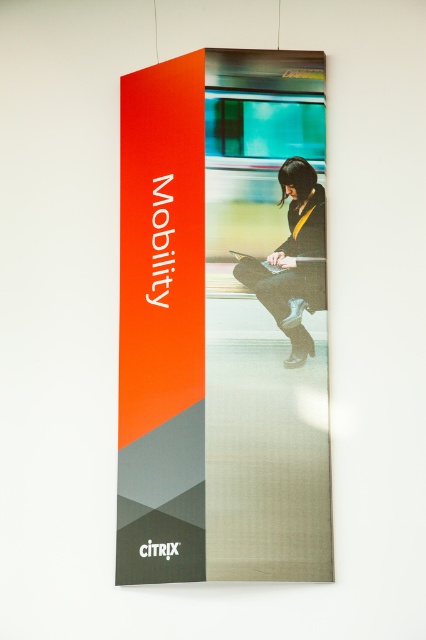
You are a delivery person who needs to hang a rectangular package that is 1.2 meters wide. You see the orange matte poster at center and the black leather jacket at center. Which object can you hang without overlapping the poster?

The orange matte poster at center is wider than the black leather jacket at center. Since the package is 1.2 meters wide, you should hang it where the black leather jacket at center is placed because it is narrower, allowing the package to fit without overlapping the poster.

You are standing in front of the banner and notice an orange matte poster at center and a black leather jacket at center. Which object is positioned to the left?

The orange matte poster at center is to the left of the black leather jacket at center.

You are an interior designer assessing a wall in a waiting area. The wall has an orange matte poster at center and a black leather jacket at center. Which object occupies more vertical space on the wall?

The orange matte poster at center is much taller than the black leather jacket at center, so it occupies more vertical space on the wall.